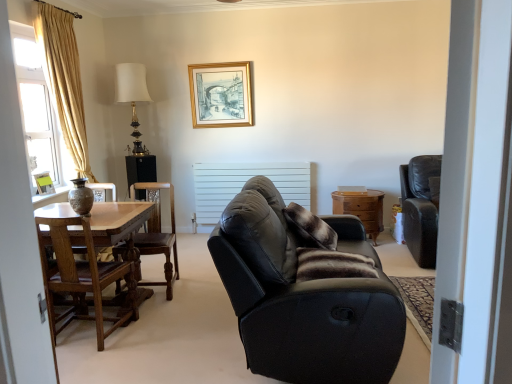
Question: Is the position of translucent glass window at left less distant than that of black leather couch at center?

Choices:
 (A) yes
 (B) no

Answer: (B)

Question: Is translucent glass window at left at the left side of black leather couch at center?

Choices:
 (A) yes
 (B) no

Answer: (A)

Question: Can you confirm if translucent glass window at left is thinner than black leather couch at center?

Choices:
 (A) no
 (B) yes

Answer: (B)

Question: From a real-world perspective, is translucent glass window at left positioned under black leather couch at center based on gravity?

Choices:
 (A) no
 (B) yes

Answer: (A)

Question: Can you confirm if translucent glass window at left is wider than black leather couch at center?

Choices:
 (A) no
 (B) yes

Answer: (A)

Question: Considering the relative positions of matte gold picture frame at left, marked as the first picture frame in a left-to-right arrangement, and black leather couch at center in the image provided, is matte gold picture frame at left, marked as the first picture frame in a left-to-right arrangement, to the left or to the right of black leather couch at center?

Choices:
 (A) left
 (B) right

Answer: (A)

Question: From the image's perspective, relative to black leather couch at center, is matte gold picture frame at left, positioned as the 1th picture frame in front-to-back order, above or below?

Choices:
 (A) below
 (B) above

Answer: (B)

Question: From their relative heights in the image, would you say matte gold picture frame at left, the first picture frame in the bottom-to-top sequence, is taller or shorter than black leather couch at center?

Choices:
 (A) short
 (B) tall

Answer: (A)

Question: Is matte gold picture frame at left, marked as the first picture frame in a left-to-right arrangement, situated inside black leather couch at center or outside?

Choices:
 (A) inside
 (B) outside

Answer: (B)

Question: From a real-world perspective, is gold wooden picture frame at upper center, which is the first picture frame from right to left, above or below matte brown vase at left?

Choices:
 (A) below
 (B) above

Answer: (B)

Question: From the image's perspective, is gold wooden picture frame at upper center, the 2th picture frame in the bottom-to-top sequence, positioned above or below matte brown vase at left?

Choices:
 (A) below
 (B) above

Answer: (B)

Question: Looking at the image, does gold wooden picture frame at upper center, the 2th picture frame in the bottom-to-top sequence, seem bigger or smaller compared to matte brown vase at left?

Choices:
 (A) small
 (B) big

Answer: (B)

Question: Considering the positions of gold wooden picture frame at upper center, acting as the second picture frame starting from the left, and matte brown vase at left in the image, is gold wooden picture frame at upper center, acting as the second picture frame starting from the left, wider or thinner than matte brown vase at left?

Choices:
 (A) wide
 (B) thin

Answer: (B)

Question: Choose the correct answer: Is brown fur pillow at center, the first pillow viewed from the front, inside translucent glass window at left or outside it?

Choices:
 (A) inside
 (B) outside

Answer: (B)

Question: Is brown fur pillow at center, marked as the second pillow in a back-to-front arrangement, in front of or behind translucent glass window at left in the image?

Choices:
 (A) behind
 (B) front

Answer: (B)